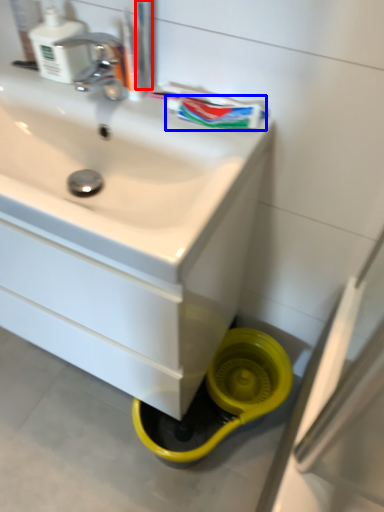
Question: Which object appears farthest to the camera in this image, toothbrush (highlighted by a red box) or toothpaste (highlighted by a blue box)?

Choices:
 (A) toothbrush
 (B) toothpaste

Answer: (B)